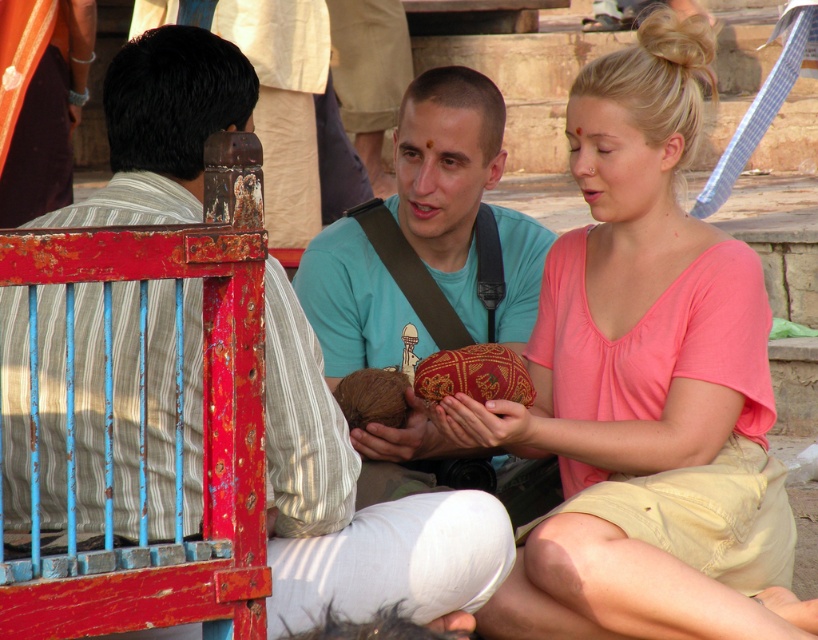
You are a photographer trying to capture a closeup of the matte brown coconut at center and the matte teal shirt at center. Which object should you focus on first to ensure it appears sharp in the photo?

The matte brown coconut at center is closer to the viewer than the matte teal shirt at center, so you should focus on the matte brown coconut at center first to ensure it appears sharp.

You are standing in the same location as the photographer who took the image. You want to draw a straight line from your current position to the pink matte shirt at center. What is the 2D coordinate point where you should aim your drawing tool?

The 2D coordinate point where you should aim your drawing tool is at point (x=645, y=387).

You are a photographer trying to capture a clear photo of the pink matte shirt at center and the matte brown coconut at center. Which object should you focus on first to ensure it appears sharp in the photo?

The pink matte shirt at center is much taller than the matte brown coconut at center, so focusing on the pink matte shirt at center first would ensure it appears sharp since it is larger in the frame.